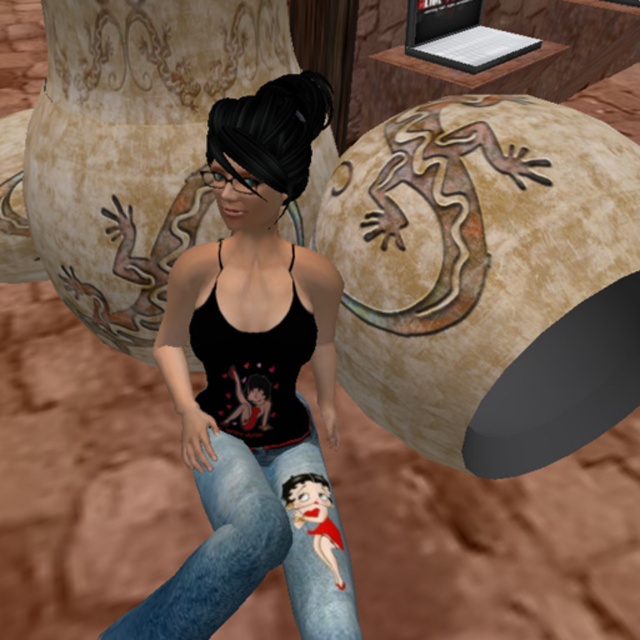
You are a photographer trying to capture a closeup shot of the black matte tank top at center. The camera you are using has a minimum focusing distance of 1 meter. Can you take the photo without moving the camera or the tank top?

The black matte tank top at center and camera are 1.25 meters apart, so yes, the photographer can take the photo since the distance is within the camera minimum focusing distance of 1 meter.

In the scene shown: You are a fashion designer analyzing the character in the image. You need to determine which clothing item takes up more visual space in the scene. Which of the two items, the black matte tank top at center or the denim jeans at center, is larger in size?

The black matte tank top at center is larger in size than the denim jeans at center, so it takes up more visual space in the scene.